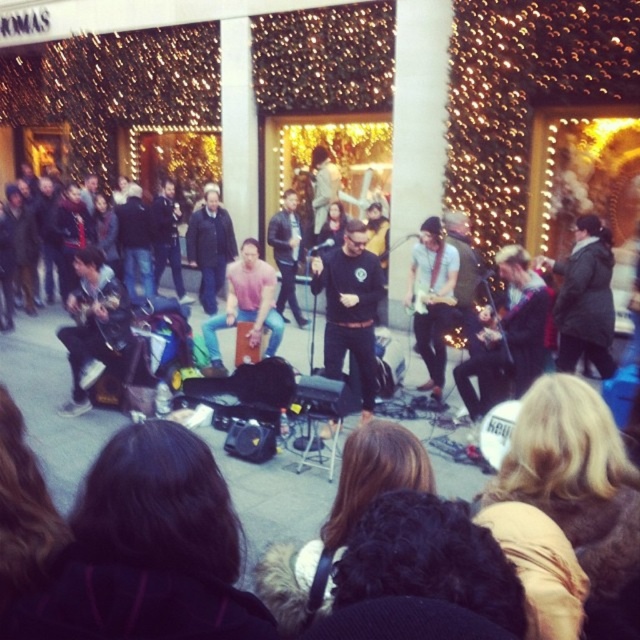
Is black matte shirt at center to the right of pink cotton shirt at center from the viewer's perspective?

Indeed, black matte shirt at center is positioned on the right side of pink cotton shirt at center.

Is black matte shirt at center further to the viewer compared to pink cotton shirt at center?

No.

The image size is (640, 640). What do you see at coordinates (349, 307) in the screenshot?
I see `black matte shirt at center` at bounding box center [349, 307].

Find the location of a particular element. black matte shirt at center is located at coordinates (349, 307).

Between point (218, 346) and point (289, 284), which one is positioned behind?

Positioned behind is point (289, 284).

Locate an element on the screen. The width and height of the screenshot is (640, 640). pink cotton shirt at center is located at coordinates (246, 305).

The width and height of the screenshot is (640, 640). Identify the location of pink cotton shirt at center. (246, 305).

In the scene shown: Is black matte shirt at center smaller than black leather jacket at center?

No.

In the scene shown: Is the position of black matte shirt at center less distant than that of black leather jacket at center?

Yes, black matte shirt at center is in front of black leather jacket at center.

I want to click on black matte shirt at center, so click(x=349, y=307).